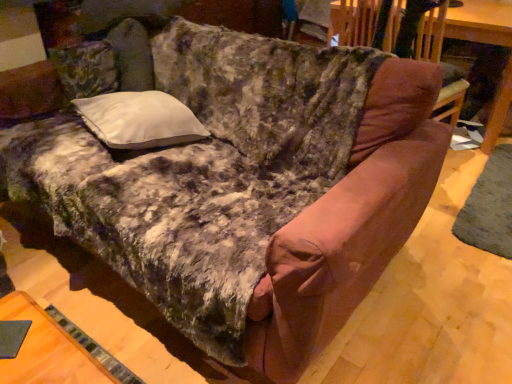
What do you see at coordinates (481, 22) in the screenshot? I see `wooden table at upper right` at bounding box center [481, 22].

At what (x,y) coordinates should I click in order to perform the action: click on wooden table at upper right. Please return your answer as a coordinate pair (x, y). The image size is (512, 384). Looking at the image, I should click on (481, 22).

Where is `wooden table at upper right`? wooden table at upper right is located at coordinates (481, 22).